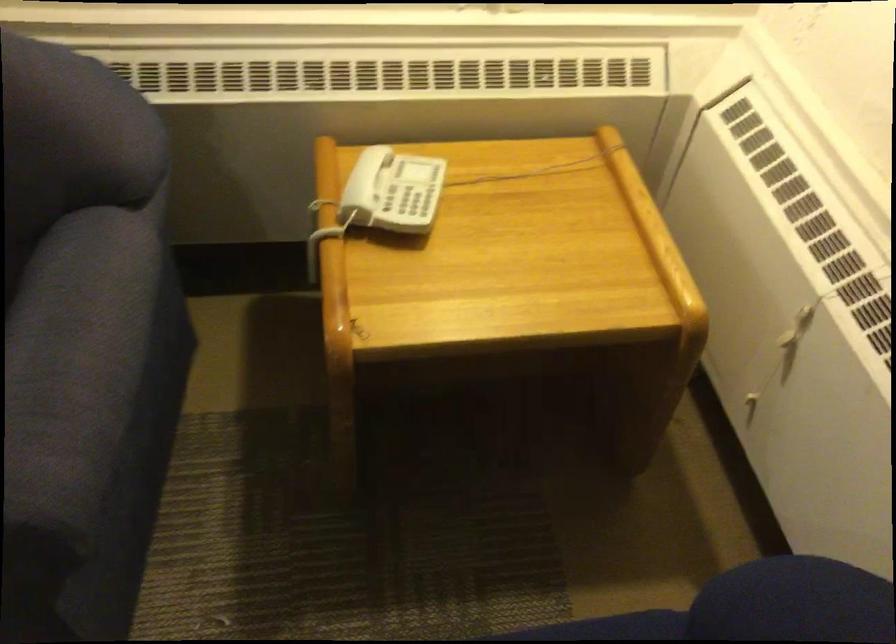
Where would you sit the blue sofa sitting surface? Please return your answer as a coordinate pair (x, y).

(612, 627)